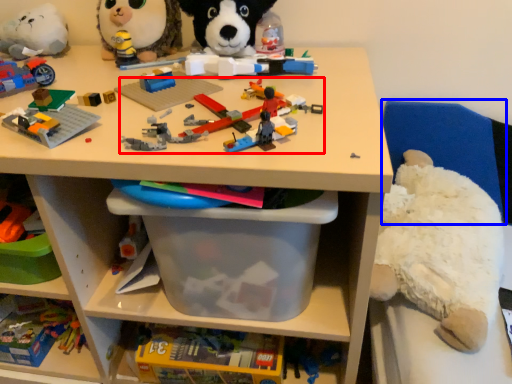
Question: Which of the following is the farthest to the observer, toy (highlighted by a red box) or chair (highlighted by a blue box)?

Choices:
 (A) toy
 (B) chair

Answer: (B)